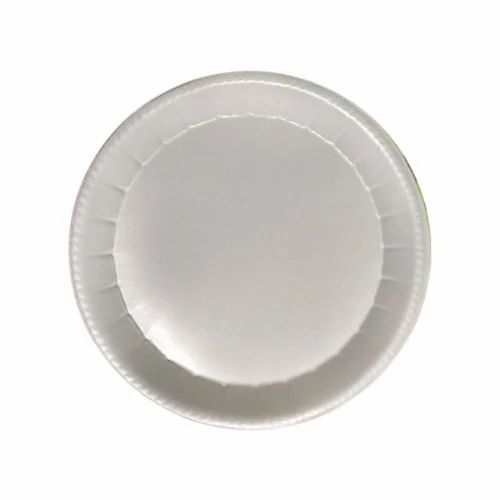
Identify the location of bottom of plate. (247, 246).